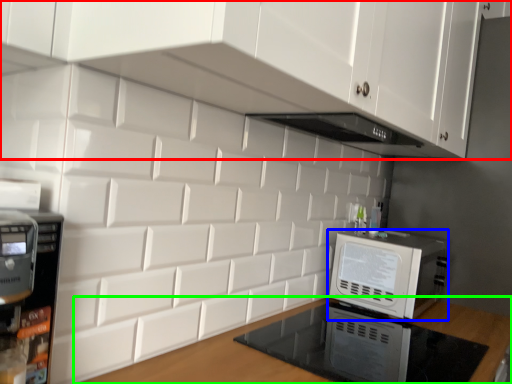
Question: Which object is the closest to the cabinetry (highlighted by a red box)? Choose among these: home appliance (highlighted by a blue box) or countertop (highlighted by a green box).

Choices:
 (A) home appliance
 (B) countertop

Answer: (A)